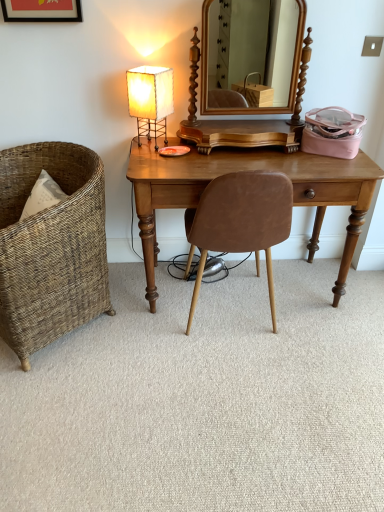
This screenshot has width=384, height=512. I want to click on light brown wood desk at center, so click(x=250, y=169).

This screenshot has height=512, width=384. What do you see at coordinates (150, 100) in the screenshot? I see `white paper lampshade at upper left` at bounding box center [150, 100].

Identify the location of white paper lampshade at upper left. The image size is (384, 512). (150, 100).

Locate an element on the screen. brown leather chair at center, which is the 1th chair from right to left is located at coordinates (240, 221).

Considering the sizes of light brown wood desk at center and woven wicker chair at left, arranged as the first chair when viewed from the left, in the image, is light brown wood desk at center wider or thinner than woven wicker chair at left, arranged as the first chair when viewed from the left,?

Considering their sizes, light brown wood desk at center looks slimmer than woven wicker chair at left, arranged as the first chair when viewed from the left.

Can you confirm if light brown wood desk at center is bigger than woven wicker chair at left, arranged as the second chair when viewed from the right?

Indeed, light brown wood desk at center has a larger size compared to woven wicker chair at left, arranged as the second chair when viewed from the right.

In the scene shown: Is light brown wood desk at center not near woven wicker chair at left, arranged as the second chair when viewed from the right?

Actually, light brown wood desk at center and woven wicker chair at left, arranged as the second chair when viewed from the right, are a little close together.

From a real-world perspective, is light brown wood desk at center positioned above or below woven wicker chair at left, arranged as the first chair when viewed from the left?

light brown wood desk at center is situated lower than woven wicker chair at left, arranged as the first chair when viewed from the left, in the real world.

Is white paper lampshade at upper left facing towards woven wicker chair at left, arranged as the second chair when viewed from the right?

No, white paper lampshade at upper left is not facing towards woven wicker chair at left, arranged as the second chair when viewed from the right.

Is white paper lampshade at upper left inside the boundaries of woven wicker chair at left, arranged as the second chair when viewed from the right, or outside?

white paper lampshade at upper left exists outside the volume of woven wicker chair at left, arranged as the second chair when viewed from the right.

Does white paper lampshade at upper left come behind woven wicker chair at left, arranged as the first chair when viewed from the left?

Yes, it is.

Is point (163, 67) more distant than point (81, 161)?

No, (163, 67) is closer to viewer.

Would you say light brown wood desk at center is a long distance from white paper lampshade at upper left?

No, light brown wood desk at center is in close proximity to white paper lampshade at upper left.

Would you say white paper lampshade at upper left is part of light brown wood desk at center's contents?

No, white paper lampshade at upper left is not surrounded by light brown wood desk at center.

In order to click on lamp that appears above the light brown wood desk at center (from the image's perspective) in this screenshot , I will do `click(150, 100)`.

Consider the image. Is light brown wood desk at center looking in the opposite direction of white paper lampshade at upper left?

No, light brown wood desk at center is not facing away from white paper lampshade at upper left.

Considering the relative sizes of woven wicker chair at left, arranged as the first chair when viewed from the left, and brown leather chair at center, placed as the second chair when sorted from left to right, in the image provided, is woven wicker chair at left, arranged as the first chair when viewed from the left, wider than brown leather chair at center, placed as the second chair when sorted from left to right,?

Indeed, woven wicker chair at left, arranged as the first chair when viewed from the left, has a greater width compared to brown leather chair at center, placed as the second chair when sorted from left to right.

Considering the sizes of woven wicker chair at left, arranged as the first chair when viewed from the left, and brown leather chair at center, placed as the second chair when sorted from left to right, in the image, is woven wicker chair at left, arranged as the first chair when viewed from the left, bigger or smaller than brown leather chair at center, placed as the second chair when sorted from left to right,?

Considering their sizes, woven wicker chair at left, arranged as the first chair when viewed from the left, takes up more space than brown leather chair at center, placed as the second chair when sorted from left to right.

Is brown leather chair at center, which is the 1th chair from right to left, inside woven wicker chair at left, arranged as the first chair when viewed from the left?

That's incorrect, brown leather chair at center, which is the 1th chair from right to left, is not inside woven wicker chair at left, arranged as the first chair when viewed from the left.

Considering the positions of objects woven wicker chair at left, arranged as the first chair when viewed from the left, and brown leather chair at center, which is the 1th chair from right to left, in the image provided, who is more to the right, woven wicker chair at left, arranged as the first chair when viewed from the left, or brown leather chair at center, which is the 1th chair from right to left,?

brown leather chair at center, which is the 1th chair from right to left.

Which is more to the right, carpet at center or woven wicker chair at left, arranged as the second chair when viewed from the right?

From the viewer's perspective, carpet at center appears more on the right side.

Are carpet at center and woven wicker chair at left, arranged as the second chair when viewed from the right, making contact?

No, carpet at center is not making contact with woven wicker chair at left, arranged as the second chair when viewed from the right.

Is carpet at center facing towards woven wicker chair at left, arranged as the second chair when viewed from the right?

No, carpet at center does not turn towards woven wicker chair at left, arranged as the second chair when viewed from the right.

Between carpet at center and woven wicker chair at left, arranged as the first chair when viewed from the left, which one has larger size?

woven wicker chair at left, arranged as the first chair when viewed from the left.

Is matte black picture frame at upper left smaller than carpet at center?

Indeed, matte black picture frame at upper left has a smaller size compared to carpet at center.

Is matte black picture frame at upper left taller than carpet at center?

Yes.

Is carpet at center at the back of matte black picture frame at upper left?

No.

From a real-world perspective, is matte black picture frame at upper left physically below carpet at center?

No, from a real-world perspective, matte black picture frame at upper left is not beneath carpet at center.

Is white paper lampshade at upper left bigger than wooden mirror at center?

No, white paper lampshade at upper left is not bigger than wooden mirror at center.

Considering the sizes of white paper lampshade at upper left and wooden mirror at center in the image, is white paper lampshade at upper left taller or shorter than wooden mirror at center?

In the image, white paper lampshade at upper left appears to be shorter than wooden mirror at center.

Does white paper lampshade at upper left touch wooden mirror at center?

No, white paper lampshade at upper left is not touching wooden mirror at center.

In the scene shown: Between white paper lampshade at upper left and wooden mirror at center, which one is positioned in front?

wooden mirror at center is more forward.

I want to click on desk that is under the woven wicker chair at left, arranged as the first chair when viewed from the left (from a real-world perspective), so click(250, 169).

This screenshot has width=384, height=512. What are the coordinates of `lamp located above the woven wicker chair at left, arranged as the second chair when viewed from the right (from the image's perspective)` in the screenshot? It's located at (150, 100).

Estimate the real-world distances between objects in this image. Which object is further from wooden mirror at center, matte black picture frame at upper left or brown leather chair at center, which is the 1th chair from right to left?

brown leather chair at center, which is the 1th chair from right to left.

Which object lies nearer to the anchor point light brown wood desk at center, wooden mirror at center or woven wicker chair at left, arranged as the second chair when viewed from the right?

Among the two, woven wicker chair at left, arranged as the second chair when viewed from the right, is located nearer to light brown wood desk at center.

Estimate the real-world distances between objects in this image. Which object is further from white paper lampshade at upper left, matte black picture frame at upper left or carpet at center?

Among the two, carpet at center is located further to white paper lampshade at upper left.

Estimate the real-world distances between objects in this image. Which object is closer to white paper lampshade at upper left, light brown wood desk at center or brown leather chair at center, placed as the second chair when sorted from left to right?

Among the two, light brown wood desk at center is located nearer to white paper lampshade at upper left.

Which object lies further to the anchor point woven wicker chair at left, arranged as the second chair when viewed from the right, light brown wood desk at center or matte black picture frame at upper left?

matte black picture frame at upper left lies further to woven wicker chair at left, arranged as the second chair when viewed from the right, than the other object.

From the image, which object appears to be nearer to brown leather chair at center, placed as the second chair when sorted from left to right, light brown wood desk at center or white paper lampshade at upper left?

Among the two, light brown wood desk at center is located nearer to brown leather chair at center, placed as the second chair when sorted from left to right.

Considering their positions, is carpet at center positioned further to brown leather chair at center, placed as the second chair when sorted from left to right, than matte black picture frame at upper left?

matte black picture frame at upper left is further to brown leather chair at center, placed as the second chair when sorted from left to right.

Considering their positions, is woven wicker chair at left, arranged as the second chair when viewed from the right, positioned further to light brown wood desk at center than wooden mirror at center?

wooden mirror at center is positioned further to the anchor light brown wood desk at center.

What are the coordinates of `plain between woven wicker chair at left, arranged as the first chair when viewed from the left, and brown leather chair at center, which is the 1th chair from right to left` in the screenshot? It's located at (205, 399).

Locate an element on the screen. The width and height of the screenshot is (384, 512). lamp that lies between matte black picture frame at upper left and woven wicker chair at left, arranged as the second chair when viewed from the right, from top to bottom is located at coordinates (150, 100).

You are a GUI agent. You are given a task and a screenshot of the screen. Output one action in this format:
    pyautogui.click(x=<x>, y=<y>)
    Task: Click on the desk between wooden mirror at center and carpet at center from top to bottom
    
    Given the screenshot: What is the action you would take?
    pyautogui.click(x=250, y=169)

The height and width of the screenshot is (512, 384). I want to click on lamp between matte black picture frame at upper left and wooden mirror at center, so click(x=150, y=100).